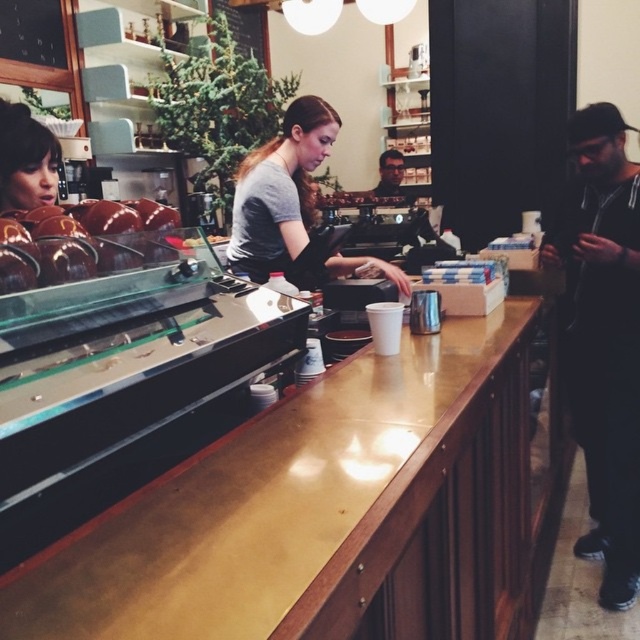
Does gold polished wood counter at center appear under matte black jacket at center?

Indeed, gold polished wood counter at center is positioned under matte black jacket at center.

What do you see at coordinates (324, 512) in the screenshot? I see `gold polished wood counter at center` at bounding box center [324, 512].

In order to click on gold polished wood counter at center in this screenshot , I will do `click(324, 512)`.

Based on the photo, is black matte jacket at right behind chocolate-coated nuts at left?

Yes.

Does black matte jacket at right have a smaller size compared to chocolate-coated nuts at left?

No.

This screenshot has height=640, width=640. In order to click on black matte jacket at right in this screenshot , I will do `click(604, 337)`.

Identify the location of black matte jacket at right. This screenshot has height=640, width=640. (604, 337).

Is chocolate-coated nuts at left above matte black jacket at center?

No, chocolate-coated nuts at left is not above matte black jacket at center.

Does point (157, 224) lie behind point (385, 164)?

No, (157, 224) is closer to viewer.

Who is more distant from viewer, (26, 216) or (378, 161)?

Positioned behind is point (378, 161).

The height and width of the screenshot is (640, 640). Identify the location of chocolate-coated nuts at left. (84, 237).